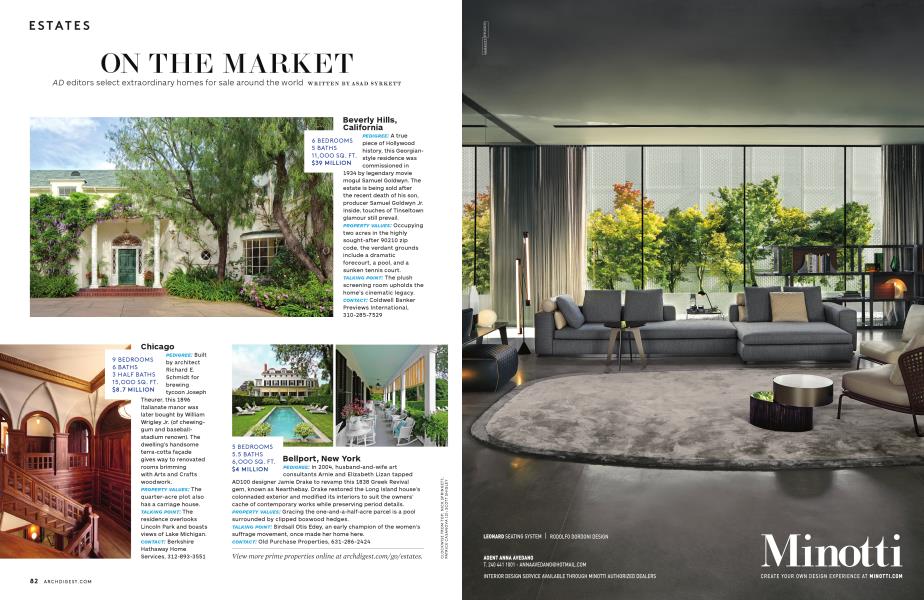
You are a GUI agent. You are given a task and a screenshot of the screen. Output one action in this format:
    pyautogui.click(x=<x>, y=<y>)
    Task: Click on the tiled floor
    
    Given the screenshot: What is the action you would take?
    pyautogui.click(x=688, y=523)